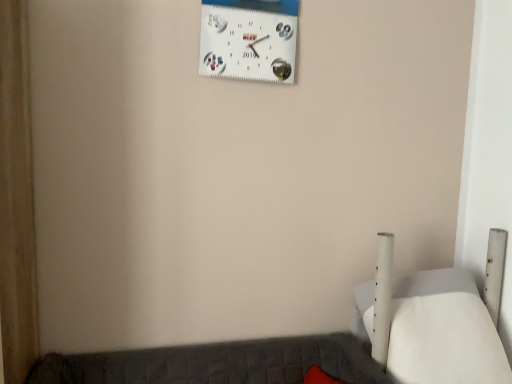
This screenshot has width=512, height=384. What do you see at coordinates (249, 39) in the screenshot?
I see `white matte wall clock at upper center` at bounding box center [249, 39].

This screenshot has width=512, height=384. In order to click on white matte wall clock at upper center in this screenshot , I will do `click(249, 39)`.

What do you see at coordinates (436, 321) in the screenshot?
I see `white matte bed at lower right` at bounding box center [436, 321].

Looking at this image, in order to face white matte bed at lower right, should I rotate leftwards or rightwards?

Rotate right and turn 26.653 degrees.

The image size is (512, 384). In order to click on white matte bed at lower right in this screenshot , I will do `click(436, 321)`.

Locate an element on the screen. white matte wall clock at upper center is located at coordinates (249, 39).

Considering the relative positions of white matte wall clock at upper center and white matte bed at lower right in the image provided, is white matte wall clock at upper center to the left or to the right of white matte bed at lower right?

From the image, it's evident that white matte wall clock at upper center is to the left of white matte bed at lower right.

Which is in front, white matte wall clock at upper center or white matte bed at lower right?

white matte bed at lower right is closer to the camera.

Which is farther from the camera, [277,15] or [466,303]?

Point [466,303]

From the image's perspective, is white matte wall clock at upper center located above white matte bed at lower right?

Yes.

From a real-world perspective, who is located lower, white matte wall clock at upper center or white matte bed at lower right?

In real-world perspective, white matte bed at lower right is lower.

Between white matte wall clock at upper center and white matte bed at lower right, which one has smaller width?

Thinner between the two is white matte wall clock at upper center.

Can you confirm if white matte wall clock at upper center is shorter than white matte bed at lower right?

Indeed, white matte wall clock at upper center has a lesser height compared to white matte bed at lower right.

Can you confirm if white matte wall clock at upper center is smaller than white matte bed at lower right?

Yes, white matte wall clock at upper center is smaller than white matte bed at lower right.

Is white matte bed at lower right completely or partially inside white matte wall clock at upper center?

No, white matte bed at lower right is not inside white matte wall clock at upper center.

Is white matte wall clock at upper center far away from white matte bed at lower right?

That's right, there is a large distance between white matte wall clock at upper center and white matte bed at lower right.

From the picture: Is white matte wall clock at upper center positioned with its back to white matte bed at lower right?

That's not correct — white matte wall clock at upper center is not looking away from white matte bed at lower right.

How many degrees apart are the facing directions of white matte wall clock at upper center and white matte bed at lower right?

The facing directions of white matte wall clock at upper center and white matte bed at lower right are 2.49 degrees apart.

Locate an element on the screen. The image size is (512, 384). wall clock located above the white matte bed at lower right (from the image's perspective) is located at coordinates (249, 39).

Would you say white matte bed at lower right is to the left or to the right of white matte wall clock at upper center in the picture?

Clearly, white matte bed at lower right is on the right of white matte wall clock at upper center in the image.

Relative to white matte wall clock at upper center, is white matte bed at lower right in front or behind?

Clearly, white matte bed at lower right is in front of white matte wall clock at upper center.

Does point (440, 313) lie behind point (297, 20)?

No, it is not.

From the image's perspective, does white matte bed at lower right appear higher than white matte wall clock at upper center?

No, from the image's perspective, white matte bed at lower right is not on top of white matte wall clock at upper center.

From a real-world perspective, is white matte bed at lower right physically located above or below white matte wall clock at upper center?

Clearly, from a real-world perspective, white matte bed at lower right is below white matte wall clock at upper center.

Between white matte bed at lower right and white matte wall clock at upper center, which one has larger width?

With larger width is white matte bed at lower right.

Can you confirm if white matte bed at lower right is shorter than white matte wall clock at upper center?

In fact, white matte bed at lower right may be taller than white matte wall clock at upper center.

Considering the sizes of objects white matte bed at lower right and white matte wall clock at upper center in the image provided, who is smaller, white matte bed at lower right or white matte wall clock at upper center?

white matte wall clock at upper center is smaller.

Is white matte wall clock at upper center surrounded by white matte bed at lower right?

No, white matte bed at lower right does not contain white matte wall clock at upper center.

Is white matte bed at lower right not near white matte wall clock at upper center?

Yes, white matte bed at lower right and white matte wall clock at upper center are located far from each other.

Is white matte bed at lower right oriented away from white matte wall clock at upper center?

white matte bed at lower right is not turned away from white matte wall clock at upper center.

In the image, there is a white matte wall clock at upper center. Where is `furniture below it (from the image's perspective)`? The image size is (512, 384). furniture below it (from the image's perspective) is located at coordinates (436, 321).

Locate an element on the screen. The image size is (512, 384). wall clock on the left of white matte bed at lower right is located at coordinates (249, 39).

Find the location of a particular element. The width and height of the screenshot is (512, 384). furniture below the white matte wall clock at upper center (from the image's perspective) is located at coordinates (436, 321).